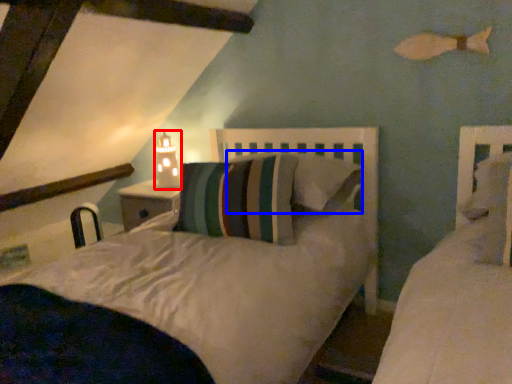
Question: Which object appears closest to the camera in this image, table lamp (highlighted by a red box) or pillow (highlighted by a blue box)?

Choices:
 (A) table lamp
 (B) pillow

Answer: (B)